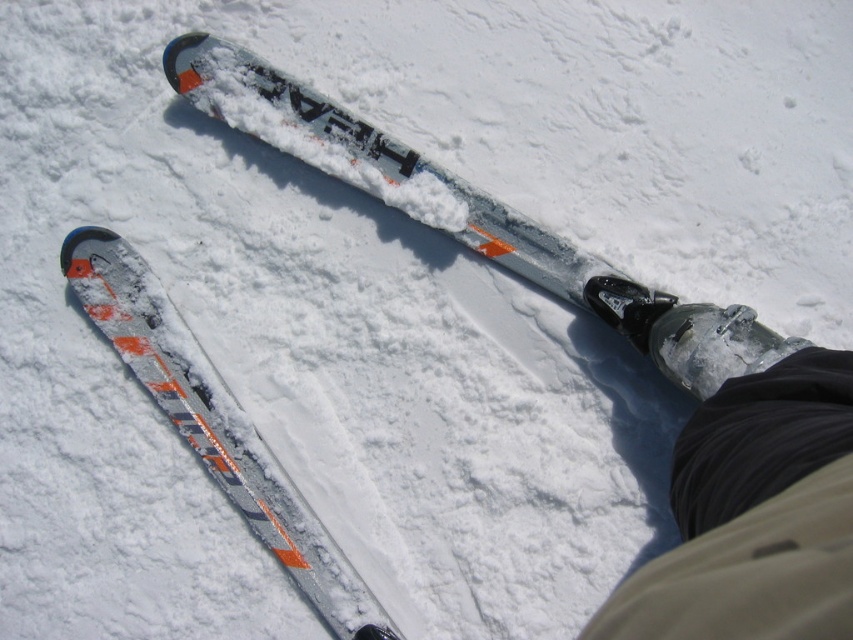
Can you confirm if black matte boot at lower right is shorter than silver metallic ski at center?

Yes, black matte boot at lower right is shorter than silver metallic ski at center.

Between point (785, 433) and point (345, 612), which one is positioned behind?

Point (345, 612)

Does point (753, 588) come farther from viewer compared to point (88, 307)?

No, it is not.

Locate an element on the screen. Image resolution: width=853 pixels, height=640 pixels. black matte boot at lower right is located at coordinates (741, 477).